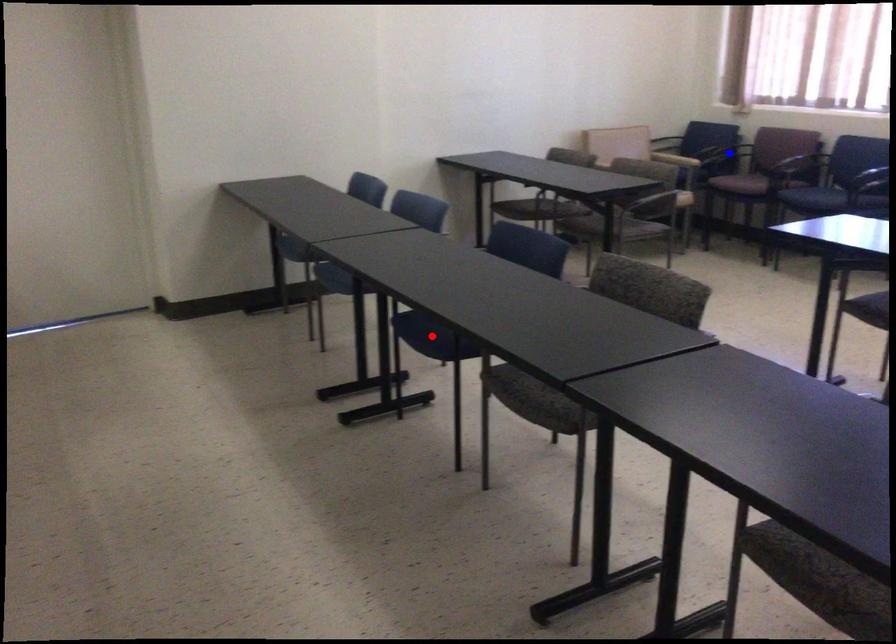
Question: Two points are marked on the image. Which point is closer to the camera?

Choices:
 (A) Blue point is closer.
 (B) Red point is closer.

Answer: (B)